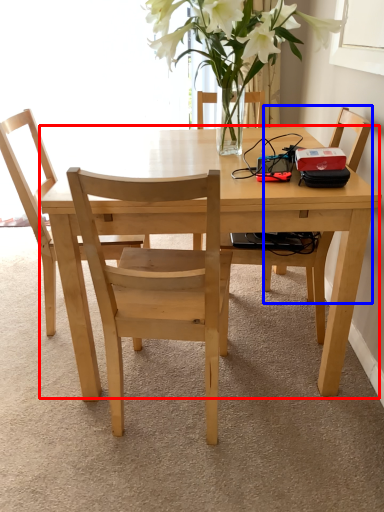
Question: Which object appears closest to the camera in this image, kitchen & dining room table (highlighted by a red box) or chair (highlighted by a blue box)?

Choices:
 (A) kitchen & dining room table
 (B) chair

Answer: (A)